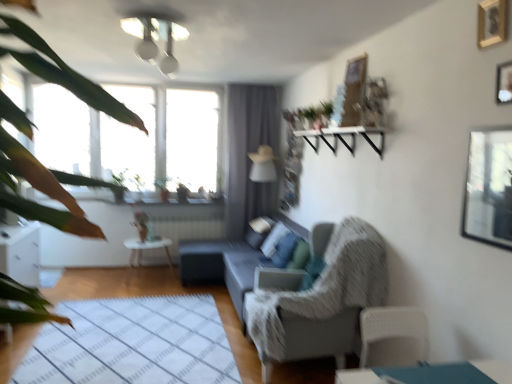
Describe the element at coordinates (489, 187) in the screenshot. This screenshot has height=384, width=512. I see `transparent glass window screen at upper right` at that location.

In order to face green leafy plant at left, should I rotate leftwards or rightwards?

To face it directly, rotate left by 27.726 degrees.

In order to click on textured gray armchair at center in this screenshot , I will do `click(318, 298)`.

What do you see at coordinates (155, 37) in the screenshot? This screenshot has width=512, height=384. I see `white glossy light fixture at upper center` at bounding box center [155, 37].

Locate an element on the screen. wooden picture frame at upper right, which is the 1th picture frame in bottom-to-top order is located at coordinates (504, 83).

I want to click on wooden picture frame at upper right, the 2th picture frame from the bottom, so click(x=490, y=22).

At what (x,y) coordinates should I click in order to perform the action: click on transparent glass window screen at upper right. Please return your answer as a coordinate pair (x, y). The height and width of the screenshot is (384, 512). Looking at the image, I should click on tap(489, 187).

Could you tell me if green leafy plant at left is turned towards transparent glass window screen at upper right?

No.

Considering the relative sizes of green leafy plant at left and transparent glass window screen at upper right in the image provided, is green leafy plant at left wider than transparent glass window screen at upper right?

Indeed, green leafy plant at left has a greater width compared to transparent glass window screen at upper right.

Measure the distance between green leafy plant at left and transparent glass window screen at upper right.

green leafy plant at left and transparent glass window screen at upper right are 1.72 meters apart.

Who is smaller, green leafy plant at left or transparent glass window screen at upper right?

Smaller between the two is transparent glass window screen at upper right.

From the image's perspective, is wooden picture frame at upper right, the 2th picture frame from the bottom, positioned above or below matte gray couch at center?

wooden picture frame at upper right, the 2th picture frame from the bottom, is situated higher than matte gray couch at center in the image.

Are wooden picture frame at upper right, which is counted as the first picture frame, starting from the top, and matte gray couch at center located far from each other?

Yes, wooden picture frame at upper right, which is counted as the first picture frame, starting from the top, and matte gray couch at center are located far from each other.

There is a matte gray couch at center. At what (x,y) coordinates should I click in order to perform the action: click on the 2nd picture frame above it (from the image's perspective). Please return your answer as a coordinate pair (x, y). The image size is (512, 384). Looking at the image, I should click on (490, 22).

Between wooden picture frame at upper right, the 2th picture frame from the bottom, and matte gray couch at center, which one has larger size?

Bigger between the two is matte gray couch at center.

Based on the photo, is white glossy light fixture at upper center far away from matte gray couch at center?

white glossy light fixture at upper center is far away from matte gray couch at center.

From their relative heights in the image, would you say white glossy light fixture at upper center is taller or shorter than matte gray couch at center?

Clearly, white glossy light fixture at upper center is shorter compared to matte gray couch at center.

Which object is closer to the camera, white glossy light fixture at upper center or matte gray couch at center?

white glossy light fixture at upper center is in front.

Considering the sizes of white glossy light fixture at upper center and matte gray couch at center in the image, is white glossy light fixture at upper center wider or thinner than matte gray couch at center?

white glossy light fixture at upper center is thinner than matte gray couch at center.

Is point (170, 60) closer or farther from the camera than point (274, 302)?

Point (170, 60) is farther from the camera than point (274, 302).

Can you confirm if white glossy light fixture at upper center is positioned to the left of textured gray armchair at center?

Indeed, white glossy light fixture at upper center is positioned on the left side of textured gray armchair at center.

From a real-world perspective, relative to textured gray armchair at center, is white glossy light fixture at upper center vertically above or below?

white glossy light fixture at upper center is situated higher than textured gray armchair at center in the real world.

Is point (510, 173) more distant than point (131, 33)?

No, (510, 173) is closer to viewer.

What's the angular difference between transparent glass window screen at upper right and white glossy light fixture at upper center's facing directions?

There is a 87.1-degree angle between the facing directions of transparent glass window screen at upper right and white glossy light fixture at upper center.

From the image's perspective, would you say transparent glass window screen at upper right is positioned over white glossy light fixture at upper center?

No, from the image's perspective, transparent glass window screen at upper right is not above white glossy light fixture at upper center.

Is transparent glass window screen at upper right situated inside white glossy light fixture at upper center or outside?

transparent glass window screen at upper right is not enclosed by white glossy light fixture at upper center.

From a real-world perspective, who is located higher, white glossy side table at center or wooden picture frame at upper right, the 2th picture frame from the bottom?

wooden picture frame at upper right, the 2th picture frame from the bottom, from a real-world perspective.

From the image's perspective, which is below, white glossy side table at center or wooden picture frame at upper right, which is counted as the first picture frame, starting from the top?

From the image's view, white glossy side table at center is below.

Identify the location of table below the wooden picture frame at upper right, which is counted as the first picture frame, starting from the top (from a real-world perspective). (145, 249).

What's the angular difference between wooden picture frame at upper right, which is the 1th picture frame in bottom-to-top order, and green leafy plant at left's facing directions?

wooden picture frame at upper right, which is the 1th picture frame in bottom-to-top order, and green leafy plant at left are facing 91.6 degrees away from each other.

In the scene shown: Are wooden picture frame at upper right, which is the 1th picture frame in bottom-to-top order, and green leafy plant at left making contact?

No, wooden picture frame at upper right, which is the 1th picture frame in bottom-to-top order, is not beside green leafy plant at left.

Consider the image. Which is more to the right, wooden picture frame at upper right, the 2th picture frame viewed from the top, or green leafy plant at left?

wooden picture frame at upper right, the 2th picture frame viewed from the top.

From the image's perspective, between wooden picture frame at upper right, the 2th picture frame viewed from the top, and green leafy plant at left, who is located below?

green leafy plant at left.

Locate an element on the screen. The width and height of the screenshot is (512, 384). window screen that is behind the green leafy plant at left is located at coordinates (489, 187).

This screenshot has height=384, width=512. In order to click on picture frame that is the 2nd object above the matte gray couch at center (from a real-world perspective) in this screenshot , I will do `click(490, 22)`.

Looking at this image, which object lies further to the anchor point transparent glass window screen at upper right, wooden picture frame at upper right, the 2th picture frame from the bottom, or white glossy light fixture at upper center?

Among the two, white glossy light fixture at upper center is located further to transparent glass window screen at upper right.

Which object lies nearer to the anchor point wooden picture frame at upper right, which is the 1th picture frame in bottom-to-top order, matte gray couch at center or green leafy plant at left?

green leafy plant at left is closer to wooden picture frame at upper right, which is the 1th picture frame in bottom-to-top order.

Considering their positions, is green leafy plant at left positioned further to wooden picture frame at upper right, which is the 1th picture frame in bottom-to-top order, than matte gray couch at center?

matte gray couch at center.

Which object lies further to the anchor point green leafy plant at left, wooden picture frame at upper right, the 2th picture frame from the bottom, or matte gray couch at center?

matte gray couch at center.

Estimate the real-world distances between objects in this image. Which object is closer to textured gray armchair at center, white glossy light fixture at upper center or matte gray couch at center?

matte gray couch at center lies closer to textured gray armchair at center than the other object.

Which object lies further to the anchor point wooden picture frame at upper right, which is the 1th picture frame in bottom-to-top order, white glossy light fixture at upper center or wooden picture frame at upper right, which is counted as the first picture frame, starting from the top?

The object further to wooden picture frame at upper right, which is the 1th picture frame in bottom-to-top order, is white glossy light fixture at upper center.

Looking at the image, which one is located closer to matte gray couch at center, wooden picture frame at upper right, which is the 1th picture frame in bottom-to-top order, or wooden picture frame at upper right, the 2th picture frame from the bottom?

wooden picture frame at upper right, the 2th picture frame from the bottom.

Looking at the image, which one is located further to transparent glass window screen at upper right, green leafy plant at left or wooden picture frame at upper right, the 2th picture frame from the bottom?

The object further to transparent glass window screen at upper right is green leafy plant at left.

Locate an element on the screen. This screenshot has height=384, width=512. light fixture between green leafy plant at left and textured gray armchair at center along the z-axis is located at coordinates (155, 37).

Find the location of a particular element. This screenshot has width=512, height=384. window screen positioned between green leafy plant at left and white glossy side table at center from near to far is located at coordinates (489, 187).

Where is `picture frame between wooden picture frame at upper right, which is counted as the first picture frame, starting from the top, and transparent glass window screen at upper right from top to bottom`? The width and height of the screenshot is (512, 384). picture frame between wooden picture frame at upper right, which is counted as the first picture frame, starting from the top, and transparent glass window screen at upper right from top to bottom is located at coordinates (504, 83).

The height and width of the screenshot is (384, 512). In order to click on light fixture located between green leafy plant at left and white glossy side table at center in the depth direction in this screenshot , I will do `click(155, 37)`.